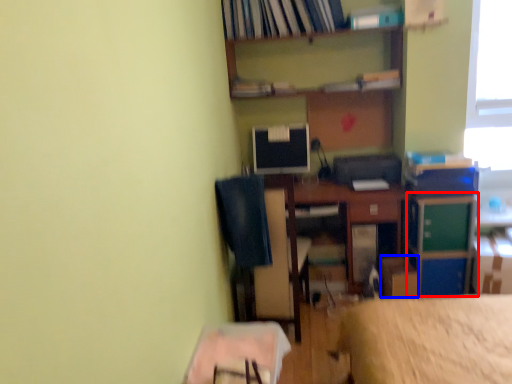
Question: Among these objects, which one is farthest to the camera, file cabinet (highlighted by a red box) or cardboard box (highlighted by a blue box)?

Choices:
 (A) file cabinet
 (B) cardboard box

Answer: (B)